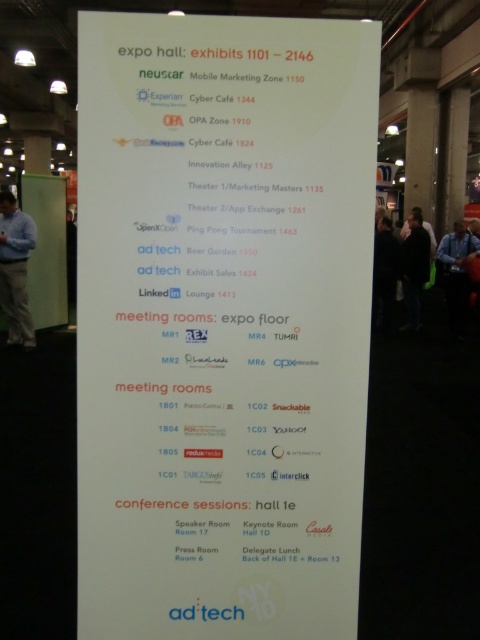
Question: Can you confirm if white paper sign at center is positioned to the right of blue shirt at left?

Choices:
 (A) no
 (B) yes

Answer: (B)

Question: Considering the relative positions of white paper sign at center and blue shirt at left in the image provided, where is white paper sign at center located with respect to blue shirt at left?

Choices:
 (A) left
 (B) right

Answer: (B)

Question: Does white paper sign at center appear over blue shirt at left?

Choices:
 (A) yes
 (B) no

Answer: (B)